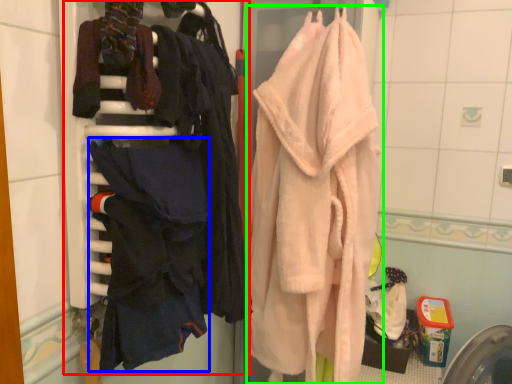
Question: Which is farther away from closet (highlighted by a red box)? clothing (highlighted by a blue box) or towel (highlighted by a green box)?

Choices:
 (A) clothing
 (B) towel

Answer: (B)